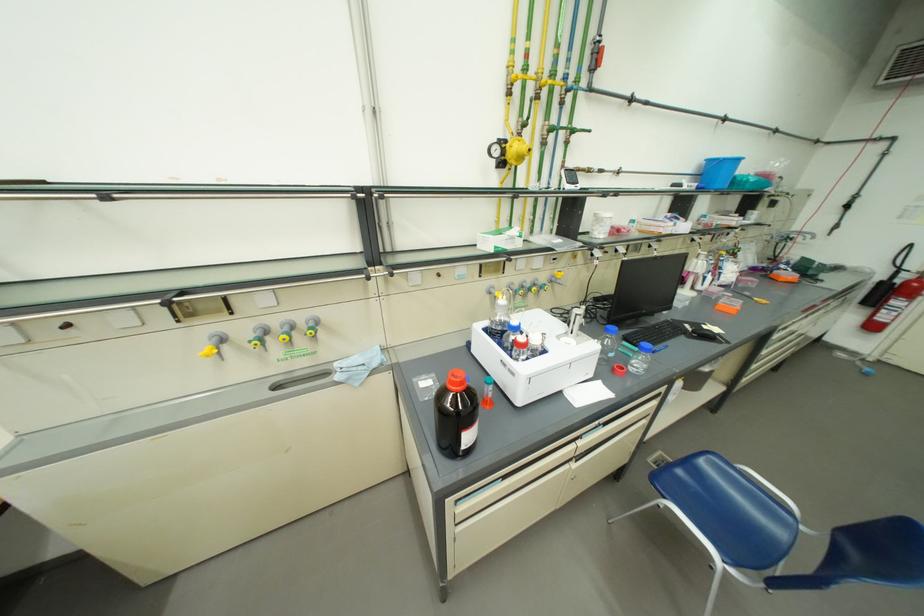
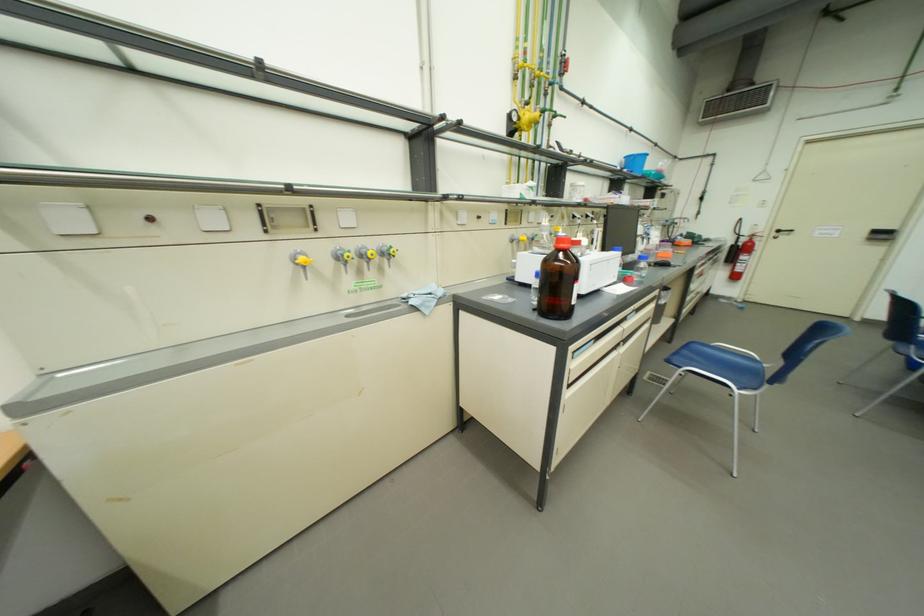
Where in the second image is the point corresponding to (678,310) from the first image?

(642, 254)